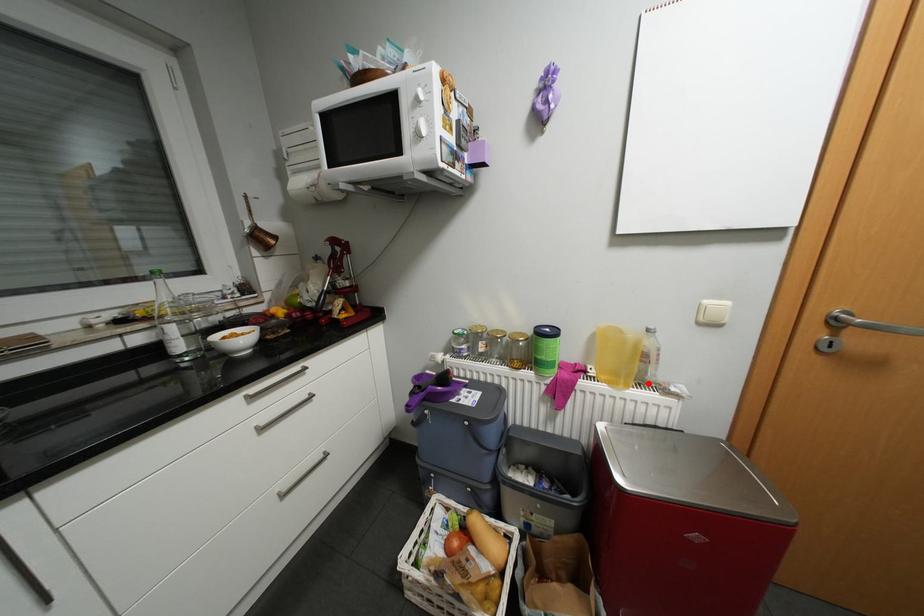
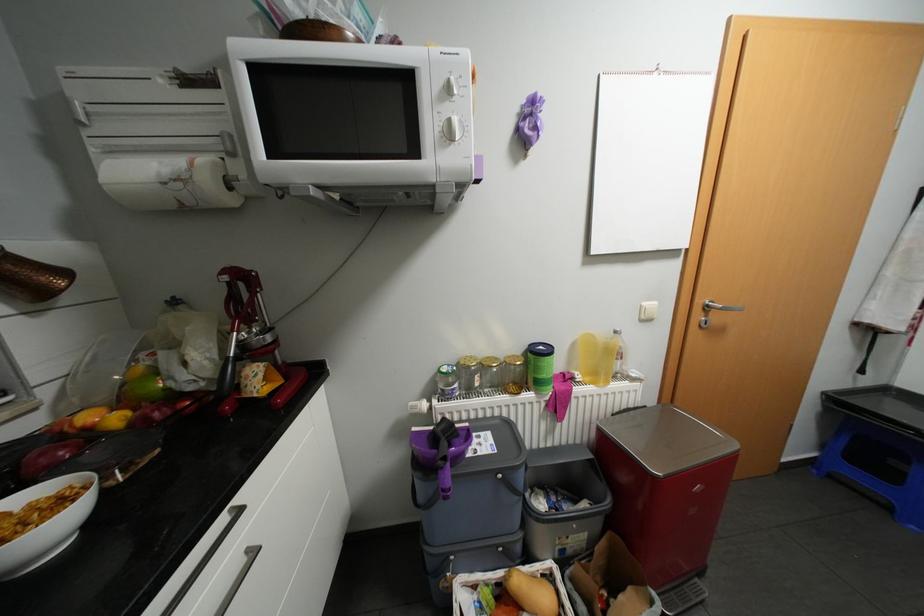
Where in the second image is the point corresponding to the highlighted location from the first image?

(622, 377)